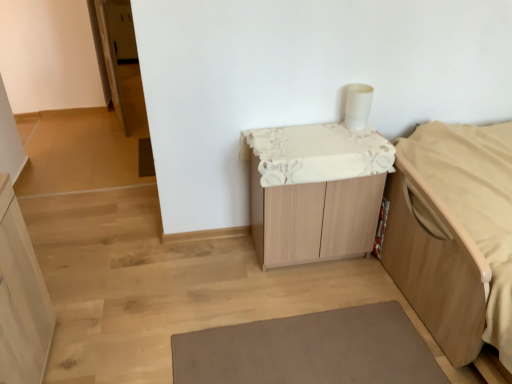
This screenshot has height=384, width=512. What do you see at coordinates (21, 298) in the screenshot? I see `light wood cabinet at left` at bounding box center [21, 298].

What do you see at coordinates (315, 191) in the screenshot? I see `wooden cabinet at center` at bounding box center [315, 191].

Locate an element on the screen. light wood cabinet at left is located at coordinates (21, 298).

Locate an element on the screen. cabinetry that appears on the left of wooden cabinet at center is located at coordinates click(21, 298).

Between point (3, 285) and point (334, 146), which one is positioned behind?

The point (334, 146) is more distant.

Would you say light wood cabinet at left is a long distance from wooden cabinet at center?

Yes, light wood cabinet at left is far from wooden cabinet at center.

Image resolution: width=512 pixels, height=384 pixels. What are the coordinates of `bath mat below the wooden cabinet at center (from the image's perspective)` in the screenshot? It's located at (310, 350).

Is gray matte bath mat at lower center completely or partially inside wooden cabinet at center?

Actually, gray matte bath mat at lower center is outside wooden cabinet at center.

Looking at this image, considering the sizes of objects wooden cabinet at center and gray matte bath mat at lower center in the image provided, who is thinner, wooden cabinet at center or gray matte bath mat at lower center?

Thinner between the two is wooden cabinet at center.

Considering the relative positions of wooden cabinet at center and gray matte bath mat at lower center in the image provided, is wooden cabinet at center in front of gray matte bath mat at lower center?

No, wooden cabinet at center is further to the viewer.

Is wooden cabinet at center positioned far away from light wood bed frame at right?

No, there isn't a large distance between wooden cabinet at center and light wood bed frame at right.

Considering the sizes of objects wooden cabinet at center and light wood bed frame at right in the image provided, who is smaller, wooden cabinet at center or light wood bed frame at right?

Smaller between the two is wooden cabinet at center.

Is wooden cabinet at center oriented towards light wood bed frame at right?

No, wooden cabinet at center is not aimed at light wood bed frame at right.

Is gray matte bath mat at lower center not close to light wood bed frame at right?

gray matte bath mat at lower center is near light wood bed frame at right, not far away.

Can you confirm if gray matte bath mat at lower center is thinner than light wood bed frame at right?

Yes.

Which object is positioned more to the left, gray matte bath mat at lower center or light wood bed frame at right?

Positioned to the left is gray matte bath mat at lower center.

Is light wood bed frame at right positioned in front of light wood cabinet at left?

No, light wood bed frame at right is further to the viewer.

Would you say light wood bed frame at right is to the left or to the right of light wood cabinet at left in the picture?

light wood bed frame at right is positioned on light wood cabinet at left's right side.

Is light wood cabinet at left behind gray matte bath mat at lower center?

No, light wood cabinet at left is closer to the camera.

Which object is positioned more to the left, light wood cabinet at left or gray matte bath mat at lower center?

Positioned to the left is light wood cabinet at left.

Is light wood cabinet at left oriented away from gray matte bath mat at lower center?

No, light wood cabinet at left is not facing away from gray matte bath mat at lower center.

From the image's perspective, would you say light wood bed frame at right is shown under wooden cabinet at center?

Yes.

Can you confirm if light wood bed frame at right is positioned to the left of wooden cabinet at center?

No.

Is light wood bed frame at right bigger or smaller than wooden cabinet at center?

Considering their sizes, light wood bed frame at right takes up more space than wooden cabinet at center.

This screenshot has height=384, width=512. I want to click on cabinetry that is below the wooden cabinet at center (from the image's perspective), so [x=21, y=298].

What are the coordinates of `table behind the gray matte bath mat at lower center` in the screenshot? It's located at (315, 191).

Estimate the real-world distances between objects in this image. Which object is closer to wooden cabinet at center, light wood cabinet at left or gray matte bath mat at lower center?

gray matte bath mat at lower center is positioned closer to the anchor wooden cabinet at center.

Considering their positions, is gray matte bath mat at lower center positioned further to wooden cabinet at center than light wood bed frame at right?

gray matte bath mat at lower center lies further to wooden cabinet at center than the other object.

Based on their spatial positions, is light wood cabinet at left or wooden cabinet at center closer to gray matte bath mat at lower center?

Based on the image, wooden cabinet at center appears to be nearer to gray matte bath mat at lower center.

When comparing their distances from light wood bed frame at right, does light wood cabinet at left or gray matte bath mat at lower center seem further?

light wood cabinet at left lies further to light wood bed frame at right than the other object.

Which object lies nearer to the anchor point light wood cabinet at left, gray matte bath mat at lower center or light wood bed frame at right?

gray matte bath mat at lower center lies closer to light wood cabinet at left than the other object.

When comparing their distances from light wood cabinet at left, does light wood bed frame at right or wooden cabinet at center seem further?

Based on the image, light wood bed frame at right appears to be further to light wood cabinet at left.

Looking at the image, which one is located closer to light wood bed frame at right, light wood cabinet at left or wooden cabinet at center?

Based on the image, wooden cabinet at center appears to be nearer to light wood bed frame at right.

Looking at the image, which one is located further to wooden cabinet at center, light wood bed frame at right or gray matte bath mat at lower center?

gray matte bath mat at lower center is further to wooden cabinet at center.

This screenshot has height=384, width=512. Identify the location of bath mat situated between light wood cabinet at left and light wood bed frame at right from left to right. (310, 350).

This screenshot has height=384, width=512. What are the coordinates of `table between light wood cabinet at left and light wood bed frame at right` in the screenshot? It's located at (315, 191).

Locate an element on the screen. table between gray matte bath mat at lower center and light wood bed frame at right from left to right is located at coordinates (315, 191).

Where is `bath mat located between light wood cabinet at left and wooden cabinet at center in the left-right direction`? This screenshot has width=512, height=384. bath mat located between light wood cabinet at left and wooden cabinet at center in the left-right direction is located at coordinates (310, 350).